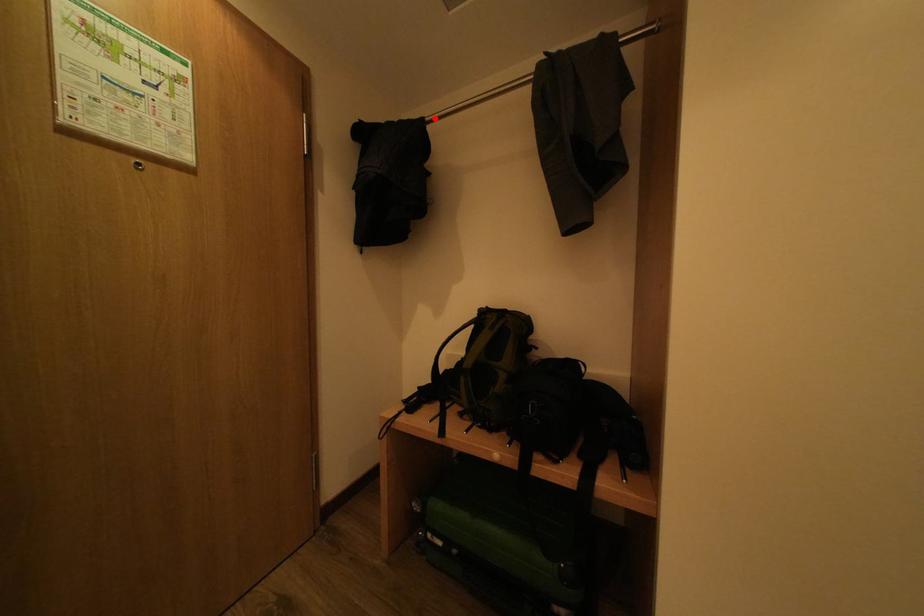
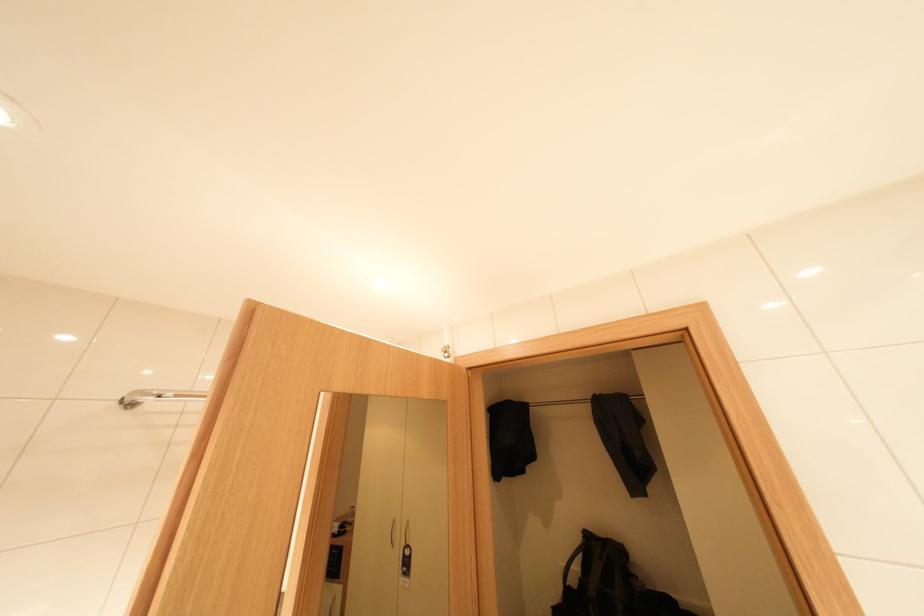
The point at the highlighted location is marked in the first image. Where is the corresponding point in the second image?

(540, 403)